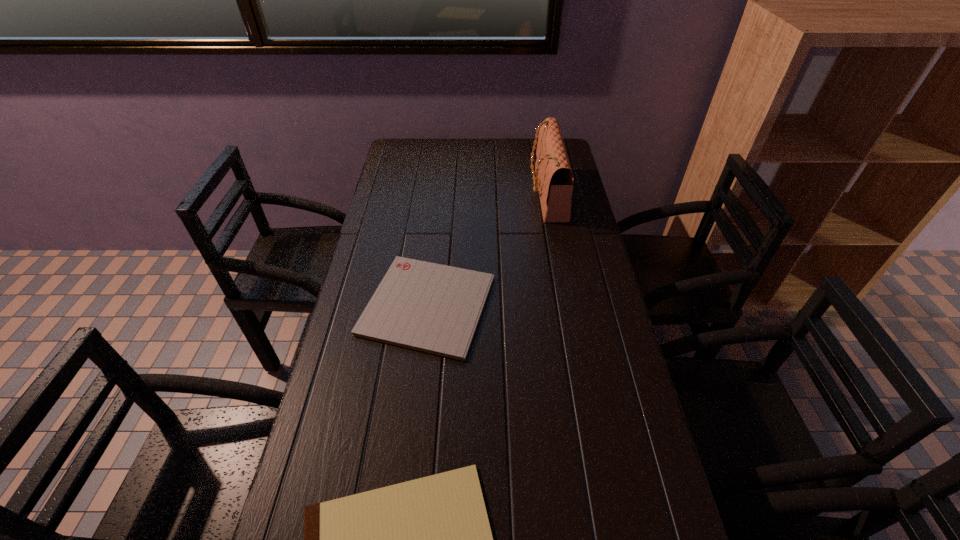
Find the location of `free space at the far edge of the desktop`. free space at the far edge of the desktop is located at coordinates (453, 140).

At what (x,y) coordinates should I click in order to perform the action: click on vacant area at the left edge. Please return your answer as a coordinate pair (x, y). The width and height of the screenshot is (960, 540). Looking at the image, I should click on (339, 402).

The image size is (960, 540). In the image, there is a desktop. Identify the location of free space at the right edge. (591, 415).

The width and height of the screenshot is (960, 540). What are the coordinates of `free space at the far left corner of the desktop` in the screenshot? It's located at click(x=409, y=167).

Where is `vacant point located between the farthest object and the second nearest object`? vacant point located between the farthest object and the second nearest object is located at coordinates (487, 249).

At what (x,y) coordinates should I click in order to perform the action: click on free point between the tallest object and the farther clipboard. Please return your answer as a coordinate pair (x, y). This screenshot has width=960, height=540. Looking at the image, I should click on click(x=487, y=249).

Find the location of a particular element. The image size is (960, 540). empty space between the tallest object and the second shortest object is located at coordinates (487, 249).

The height and width of the screenshot is (540, 960). I want to click on free space between the farther clipboard and the tallest object, so click(487, 249).

Choose which object is the nearest neighbor to the nearest object. Please provide its 2D coordinates. Your answer should be formatted as a tuple, i.e. [(x, y)], where the tuple contains the x and y coordinates of a point satisfying the conditions above.

[(433, 308)]

Locate an element on the screen. The height and width of the screenshot is (540, 960). object that can be found as the closest to the second farthest object is located at coordinates (554, 179).